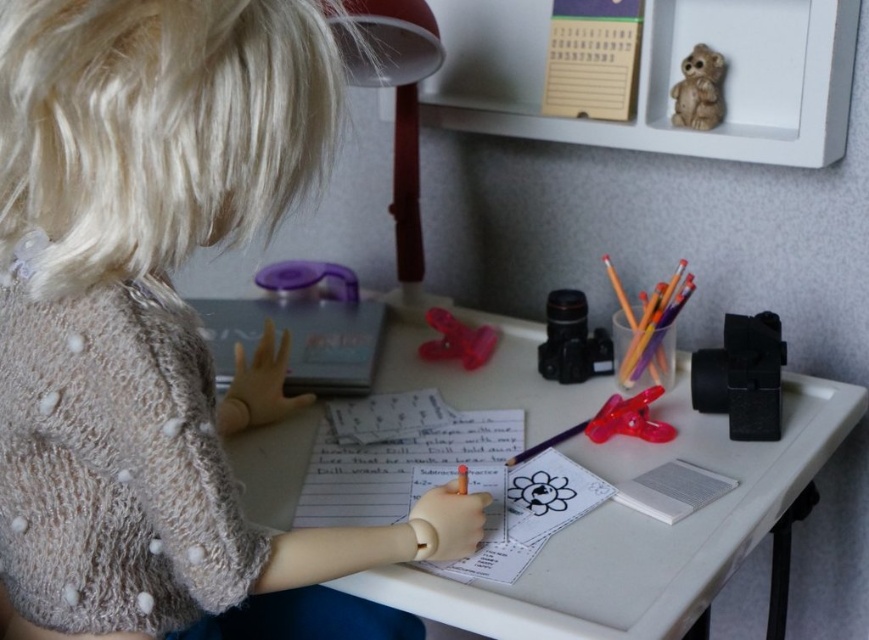
Question: Estimate the real-world distances between objects in this image. Which object is closer to the white paper notepad at right?

Choices:
 (A) white plastic table at center
 (B) black plastic camera at right

Answer: (B)

Question: Does brown matte bear at upper right have a lesser width compared to transparent plastic clip at center?

Choices:
 (A) yes
 (B) no

Answer: (A)

Question: Does black plastic camera at center have a smaller size compared to brown matte bear at upper right?

Choices:
 (A) no
 (B) yes

Answer: (A)

Question: Does transparent plastic binder clip at center have a larger size compared to transparent plastic clip at center?

Choices:
 (A) no
 (B) yes

Answer: (A)

Question: Which is farther from the white paper notepad at right?

Choices:
 (A) white paper at center
 (B) brown matte bear at upper right
 (C) transparent plastic binder clip at center
 (D) white plastic table at center

Answer: (B)

Question: Among these points, which one is nearest to the camera?

Choices:
 (A) (555, 298)
 (B) (620, 428)
 (C) (808, 380)

Answer: (B)